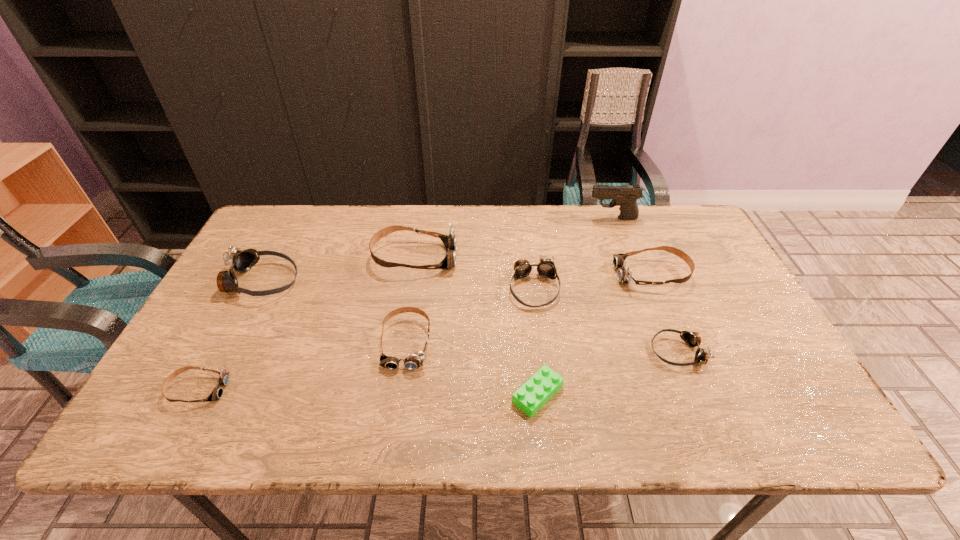
Image resolution: width=960 pixels, height=540 pixels. Find the location of `the leftmost brown goggles`. the leftmost brown goggles is located at coordinates (217, 393).

The width and height of the screenshot is (960, 540). Identify the location of the nearest brown goggles. (217, 393).

At what (x,y) coordinates should I click in order to perform the action: click on Lego. Please return your answer as a coordinate pair (x, y). This screenshot has height=540, width=960. Looking at the image, I should click on (536, 391).

Where is `free space located 0.050m at the barrel of the farthest object`? free space located 0.050m at the barrel of the farthest object is located at coordinates (573, 218).

Locate an element on the screen. The height and width of the screenshot is (540, 960). free region located at the barrel of the farthest object is located at coordinates (555, 218).

You are a GUI agent. You are given a task and a screenshot of the screen. Output one action in this format:
    pyautogui.click(x=<x>, y=<y>)
    Task: Click on the vacant space located 0.340m at the barrel of the farthest object
    
    Given the screenshot: What is the action you would take?
    click(487, 218)

Where is `vacant space positioned 0.320m on the front-facing side of the biggest brown goggles`? The width and height of the screenshot is (960, 540). vacant space positioned 0.320m on the front-facing side of the biggest brown goggles is located at coordinates (563, 258).

This screenshot has height=540, width=960. I want to click on free spot located through the lenses of the biggest bronze goggles, so pos(355,281).

The image size is (960, 540). Find the location of `free space located on the front-facing side of the rightmost brown goggles`. free space located on the front-facing side of the rightmost brown goggles is located at coordinates (540, 274).

Where is `vacant space located on the front-facing side of the rightmost brown goggles`? This screenshot has height=540, width=960. vacant space located on the front-facing side of the rightmost brown goggles is located at coordinates (540, 274).